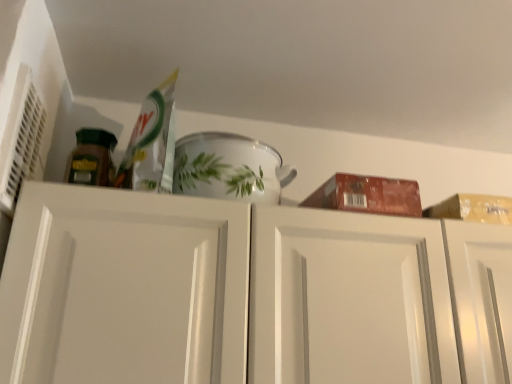
What do you see at coordinates (229, 168) in the screenshot? I see `white glossy bowl at upper center` at bounding box center [229, 168].

Locate an element on the screen. The height and width of the screenshot is (384, 512). white glossy bowl at upper center is located at coordinates (229, 168).

From the picture: What is the approximate width of white matte cabinet doors at upper center?

14.57 inches.

The image size is (512, 384). Identify the location of white matte cabinet doors at upper center. (221, 293).

The width and height of the screenshot is (512, 384). Describe the element at coordinates (221, 293) in the screenshot. I see `white matte cabinet doors at upper center` at that location.

The width and height of the screenshot is (512, 384). Identify the location of white glossy bowl at upper center. (229, 168).

Between white matte cabinet doors at upper center and white glossy bowl at upper center, which one appears on the left side from the viewer's perspective?

white glossy bowl at upper center is more to the left.

Which is behind, white matte cabinet doors at upper center or white glossy bowl at upper center?

white glossy bowl at upper center is behind.

Which is further, (103, 302) or (266, 186)?

The point (266, 186) is behind.

From the image's perspective, which one is positioned lower, white matte cabinet doors at upper center or white glossy bowl at upper center?

white matte cabinet doors at upper center.

From a real-world perspective, which object rests below the other?

white matte cabinet doors at upper center is physically lower.

Considering the sizes of objects white matte cabinet doors at upper center and white glossy bowl at upper center in the image provided, who is thinner, white matte cabinet doors at upper center or white glossy bowl at upper center?

white glossy bowl at upper center is thinner.

In the scene shown: In terms of height, does white matte cabinet doors at upper center look taller or shorter compared to white glossy bowl at upper center?

Considering their sizes, white matte cabinet doors at upper center has more height than white glossy bowl at upper center.

Consider the image. Considering the sizes of objects white matte cabinet doors at upper center and white glossy bowl at upper center in the image provided, who is bigger, white matte cabinet doors at upper center or white glossy bowl at upper center?

Bigger between the two is white matte cabinet doors at upper center.

Is white matte cabinet doors at upper center completely or partially outside of white glossy bowl at upper center?

Yes.

Is there a large distance between white matte cabinet doors at upper center and white glossy bowl at upper center?

No, white matte cabinet doors at upper center is in close proximity to white glossy bowl at upper center.

Is white matte cabinet doors at upper center oriented towards white glossy bowl at upper center?

No.

How many degrees apart are the facing directions of white matte cabinet doors at upper center and white glossy bowl at upper center?

The facing directions of white matte cabinet doors at upper center and white glossy bowl at upper center are 0.643 degrees apart.

I want to click on tableware on the left of the white matte cabinet doors at upper center, so click(x=229, y=168).

Based on their positions, is white glossy bowl at upper center located to the left or right of white matte cabinet doors at upper center?

In the image, white glossy bowl at upper center appears on the left side of white matte cabinet doors at upper center.

Who is more distant, white glossy bowl at upper center or white matte cabinet doors at upper center?

white glossy bowl at upper center.

Is point (237, 198) more distant than point (280, 381)?

Yes, it is.

From the image's perspective, is white glossy bowl at upper center located above or below white matte cabinet doors at upper center?

Clearly, from the image's perspective, white glossy bowl at upper center is above white matte cabinet doors at upper center.

From a real-world perspective, is white glossy bowl at upper center physically below white matte cabinet doors at upper center?

No.

In terms of width, does white glossy bowl at upper center look wider or thinner when compared to white matte cabinet doors at upper center?

In the image, white glossy bowl at upper center appears to be more narrow than white matte cabinet doors at upper center.

In the scene shown: Which of these two, white glossy bowl at upper center or white matte cabinet doors at upper center, stands shorter?

white glossy bowl at upper center is shorter.

Considering the relative sizes of white glossy bowl at upper center and white matte cabinet doors at upper center in the image provided, is white glossy bowl at upper center bigger than white matte cabinet doors at upper center?

Incorrect, white glossy bowl at upper center is not larger than white matte cabinet doors at upper center.

Would you say white glossy bowl at upper center is inside or outside white matte cabinet doors at upper center?

white glossy bowl at upper center is located beyond the bounds of white matte cabinet doors at upper center.

Looking at this image, does white glossy bowl at upper center touch white matte cabinet doors at upper center?

No, white glossy bowl at upper center is not in contact with white matte cabinet doors at upper center.

From the picture: Is white glossy bowl at upper center facing towards white matte cabinet doors at upper center?

No, white glossy bowl at upper center is not turned towards white matte cabinet doors at upper center.

From the picture: Can you tell me how much white glossy bowl at upper center and white matte cabinet doors at upper center differ in facing direction?

The angle between the facing direction of white glossy bowl at upper center and the facing direction of white matte cabinet doors at upper center is 0.643 degrees.

What are the coordinates of `tableware above the white matte cabinet doors at upper center (from the image's perspective)` in the screenshot? It's located at (229, 168).

Find the location of `cabinetry that is in front of the white glossy bowl at upper center`. cabinetry that is in front of the white glossy bowl at upper center is located at coordinates (221, 293).

You are a GUI agent. You are given a task and a screenshot of the screen. Output one action in this format:
    pyautogui.click(x=<x>, y=<y>)
    Task: Click on the tableware that is behind the white matte cabinet doors at upper center
    
    Given the screenshot: What is the action you would take?
    pyautogui.click(x=229, y=168)